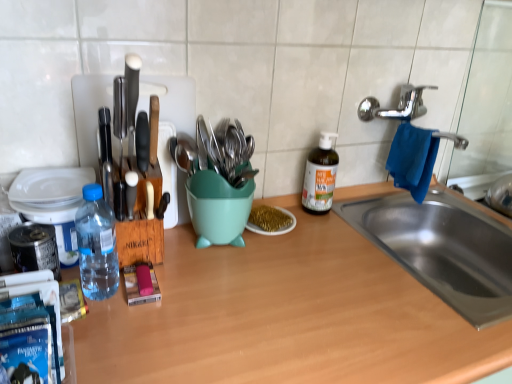
Question: Is metallic utensils at center in front of or behind blue plastic water bottle at left in the image?

Choices:
 (A) front
 (B) behind

Answer: (B)

Question: Considering the positions of metallic utensils at center and blue plastic water bottle at left in the image, is metallic utensils at center bigger or smaller than blue plastic water bottle at left?

Choices:
 (A) small
 (B) big

Answer: (A)

Question: Which of these objects is positioned closest to the teal plastic mixing bowl at center?

Choices:
 (A) metallic utensils at center
 (B) gold glitter plate at center
 (C) transparent plastic bottle at left, acting as the 1th bottle starting from the front
 (D) blue plastic water bottle at left
 (E) white glossy plate at left

Answer: (A)

Question: Which of these objects is positioned farthest from the blue plastic water bottle at left?

Choices:
 (A) wooden at center
 (B) metallic utensils at center
 (C) white glossy plate at left
 (D) green glass bottle at center, placed as the second bottle when sorted from left to right
 (E) gold glitter plate at center

Answer: (D)